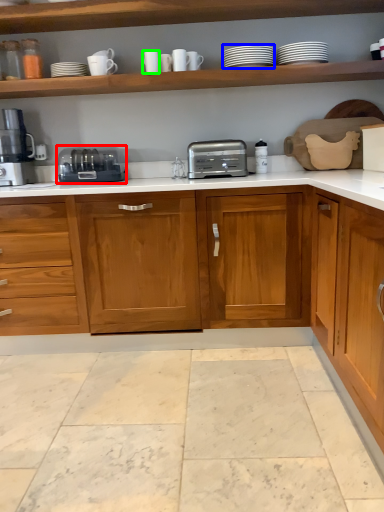
Question: Which object is positioned closest to toaster (highlighted by a red box)? Select from tableware (highlighted by a blue box) and tableware (highlighted by a green box).

Choices:
 (A) tableware
 (B) tableware

Answer: (B)